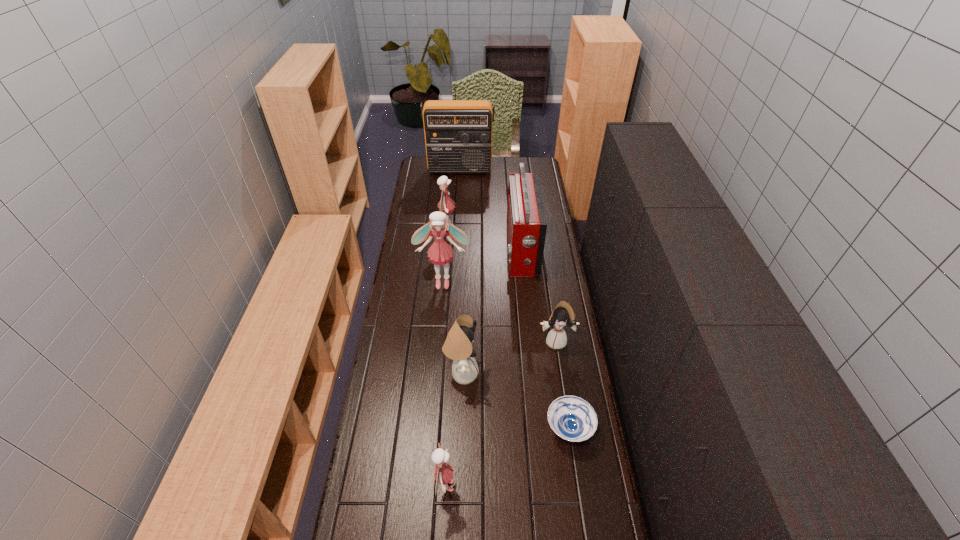
Image resolution: width=960 pixels, height=540 pixels. I want to click on the left radio receiver, so click(x=458, y=133).

Locate an element on the screen. Image resolution: width=960 pixels, height=540 pixels. the farther radio receiver is located at coordinates (458, 133).

This screenshot has height=540, width=960. What are the coordinates of `the tallest doll` in the screenshot? It's located at (439, 253).

This screenshot has height=540, width=960. Identify the location of the fourth nearest doll. 439,253.

Identify the location of the right radio receiver. The image size is (960, 540). (526, 221).

Where is `the farthest pink doll`? the farthest pink doll is located at coordinates (445, 205).

In order to click on the farthest doll in this screenshot , I will do `click(445, 205)`.

Where is `the left black doll`? the left black doll is located at coordinates (458, 346).

Identify the location of the nearest object. (443, 473).

Where is `the smallest pink doll`? the smallest pink doll is located at coordinates (443, 473).